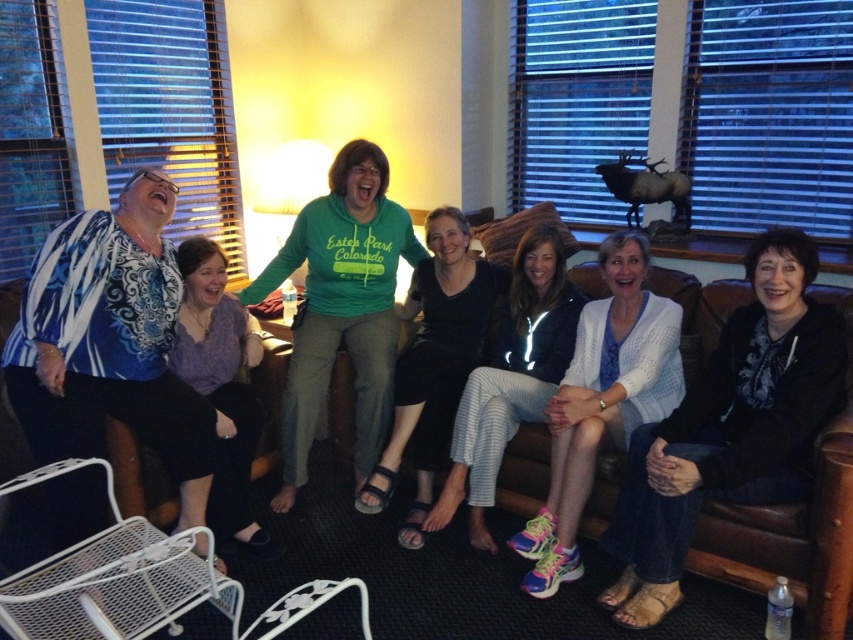
Between black cotton pants at center and matte blue blouse at left, which one has more height?

Standing taller between the two is black cotton pants at center.

Is black cotton pants at center to the right of matte blue blouse at left from the viewer's perspective?

Yes, black cotton pants at center is to the right of matte blue blouse at left.

Find the location of a particular element. black cotton pants at center is located at coordinates (434, 362).

Between point (601, 406) and point (508, 332), which one is positioned in front?

Positioned in front is point (601, 406).

Does white knit cardigan at center have a lesser width compared to white striped pants at center?

No, white knit cardigan at center is not thinner than white striped pants at center.

Is point (579, 460) farther from viewer compared to point (485, 387)?

That is False.

You are a GUI agent. You are given a task and a screenshot of the screen. Output one action in this format:
    pyautogui.click(x=<x>, y=<y>)
    Task: Click on the white knit cardigan at center
    Image resolution: width=853 pixels, height=640 pixels.
    Given the screenshot: What is the action you would take?
    pyautogui.click(x=601, y=401)

This screenshot has width=853, height=640. What do you see at coordinates (434, 362) in the screenshot?
I see `black cotton pants at center` at bounding box center [434, 362].

Can you confirm if black cotton pants at center is thinner than white striped pants at center?

Yes.

Identify the location of black cotton pants at center. Image resolution: width=853 pixels, height=640 pixels. (434, 362).